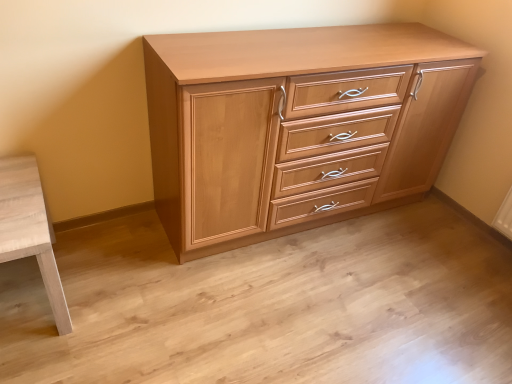
Question: Is light wood table at lower left beside light wood chest of drawers at center?

Choices:
 (A) yes
 (B) no

Answer: (B)

Question: From a real-world perspective, is light wood table at lower left physically above light wood chest of drawers at center?

Choices:
 (A) yes
 (B) no

Answer: (B)

Question: Is light wood table at lower left taller than light wood chest of drawers at center?

Choices:
 (A) no
 (B) yes

Answer: (A)

Question: Is light wood table at lower left aimed at light wood chest of drawers at center?

Choices:
 (A) no
 (B) yes

Answer: (A)

Question: Are light wood table at lower left and light wood chest of drawers at center far apart?

Choices:
 (A) yes
 (B) no

Answer: (B)

Question: From a real-world perspective, does light wood table at lower left sit lower than light wood chest of drawers at center?

Choices:
 (A) no
 (B) yes

Answer: (B)

Question: Are light wood chest of drawers at center and light wood table at lower left making contact?

Choices:
 (A) no
 (B) yes

Answer: (A)

Question: Is light wood chest of drawers at center not near light wood table at lower left?

Choices:
 (A) no
 (B) yes

Answer: (A)

Question: Can you confirm if light wood chest of drawers at center is taller than light wood table at lower left?

Choices:
 (A) no
 (B) yes

Answer: (B)

Question: Considering the relative positions of light wood chest of drawers at center and light wood table at lower left in the image provided, is light wood chest of drawers at center to the left of light wood table at lower left from the viewer's perspective?

Choices:
 (A) no
 (B) yes

Answer: (A)

Question: From a real-world perspective, is light wood chest of drawers at center on light wood table at lower left?

Choices:
 (A) yes
 (B) no

Answer: (A)

Question: Is light wood chest of drawers at center at the right side of light wood table at lower left?

Choices:
 (A) yes
 (B) no

Answer: (A)

Question: From the image's perspective, is light wood chest of drawers at center located above or below light wood table at lower left?

Choices:
 (A) above
 (B) below

Answer: (A)